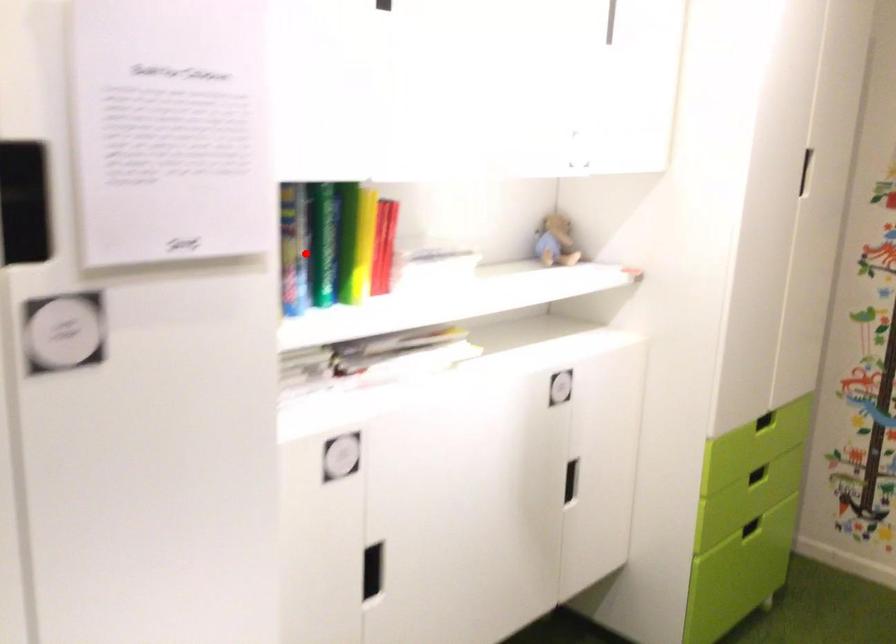
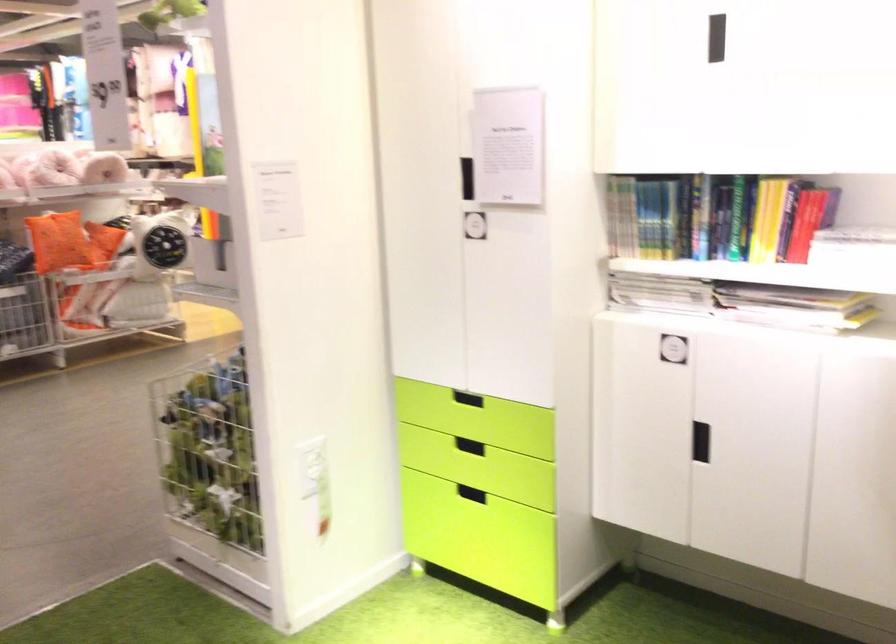
Find the pixel in the second image that matches the highlighted location in the first image.

(717, 216)